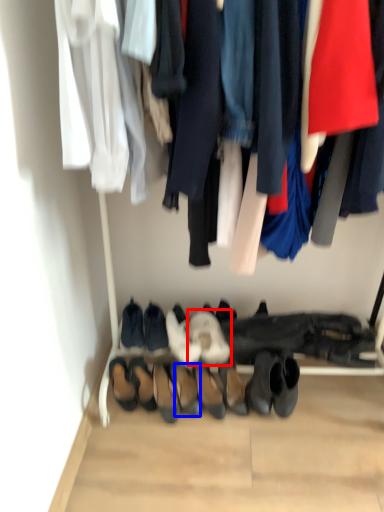
Question: Which of the following is the farthest to the observer, footwear (highlighted by a red box) or footwear (highlighted by a blue box)?

Choices:
 (A) footwear
 (B) footwear

Answer: (A)